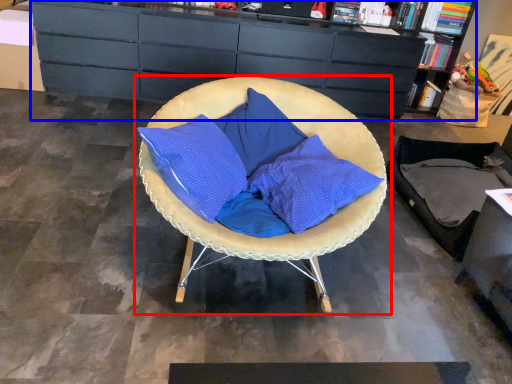
Question: Which object appears farthest to the camera in this image, chair (highlighted by a red box) or cabinetry (highlighted by a blue box)?

Choices:
 (A) chair
 (B) cabinetry

Answer: (B)